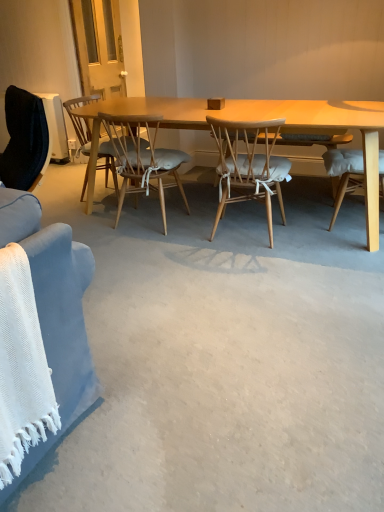
Question: From the image's perspective, is light brown wood chair at center, the second chair in the right-to-left sequence, under wooden chair with cushion at center, acting as the 3th chair starting from the right?

Choices:
 (A) no
 (B) yes

Answer: (B)

Question: Is light brown wood chair at center, the second chair in the right-to-left sequence, taller than wooden chair with cushion at center, acting as the 3th chair starting from the right?

Choices:
 (A) no
 (B) yes

Answer: (B)

Question: Is light brown wood chair at center, which ranks as the 2th chair in left-to-right order, positioned in front of wooden chair with cushion at center, which ranks as the 1th chair in left-to-right order?

Choices:
 (A) yes
 (B) no

Answer: (A)

Question: Could you tell me if light brown wood chair at center, the second chair in the right-to-left sequence, is turned towards wooden chair with cushion at center, which ranks as the 1th chair in left-to-right order?

Choices:
 (A) yes
 (B) no

Answer: (B)

Question: Considering the relative sizes of light brown wood chair at center, the second chair in the right-to-left sequence, and wooden chair with cushion at center, which ranks as the 1th chair in left-to-right order, in the image provided, is light brown wood chair at center, the second chair in the right-to-left sequence, wider than wooden chair with cushion at center, which ranks as the 1th chair in left-to-right order,?

Choices:
 (A) yes
 (B) no

Answer: (B)

Question: From the image's perspective, relative to light brown woven wood chair at center, placed as the 3th chair when sorted from left to right, is wooden chair with cushion at center, acting as the 3th chair starting from the right, above or below?

Choices:
 (A) above
 (B) below

Answer: (A)

Question: From a real-world perspective, is wooden chair with cushion at center, acting as the 3th chair starting from the right, positioned above or below light brown woven wood chair at center, the first chair positioned from the right?

Choices:
 (A) above
 (B) below

Answer: (A)

Question: Relative to light brown woven wood chair at center, the first chair positioned from the right, is wooden chair with cushion at center, which ranks as the 1th chair in left-to-right order, in front or behind?

Choices:
 (A) front
 (B) behind

Answer: (B)

Question: Is wooden chair with cushion at center, which ranks as the 1th chair in left-to-right order, taller or shorter than light brown woven wood chair at center, the first chair positioned from the right?

Choices:
 (A) tall
 (B) short

Answer: (B)

Question: Would you say light brown woven wood chair at center, placed as the 3th chair when sorted from left to right, is inside or outside light brown wood chair at center, which ranks as the 2th chair in left-to-right order?

Choices:
 (A) inside
 (B) outside

Answer: (B)

Question: From the image's perspective, is light brown woven wood chair at center, the first chair positioned from the right, located above or below light brown wood chair at center, which ranks as the 2th chair in left-to-right order?

Choices:
 (A) below
 (B) above

Answer: (A)

Question: Considering the relative positions of light brown woven wood chair at center, placed as the 3th chair when sorted from left to right, and light brown wood chair at center, which ranks as the 2th chair in left-to-right order, in the image provided, is light brown woven wood chair at center, placed as the 3th chair when sorted from left to right, to the left or to the right of light brown wood chair at center, which ranks as the 2th chair in left-to-right order,?

Choices:
 (A) right
 (B) left

Answer: (A)

Question: Considering the positions of point (243, 136) and point (122, 202), is point (243, 136) closer or farther from the camera than point (122, 202)?

Choices:
 (A) closer
 (B) farther

Answer: (A)

Question: Relative to light brown wood chair at center, which ranks as the 2th chair in left-to-right order, is wooden chair with cushion at center, acting as the 3th chair starting from the right, in front or behind?

Choices:
 (A) behind
 (B) front

Answer: (A)

Question: From their relative heights in the image, would you say wooden chair with cushion at center, acting as the 3th chair starting from the right, is taller or shorter than light brown wood chair at center, the second chair in the right-to-left sequence?

Choices:
 (A) short
 (B) tall

Answer: (A)